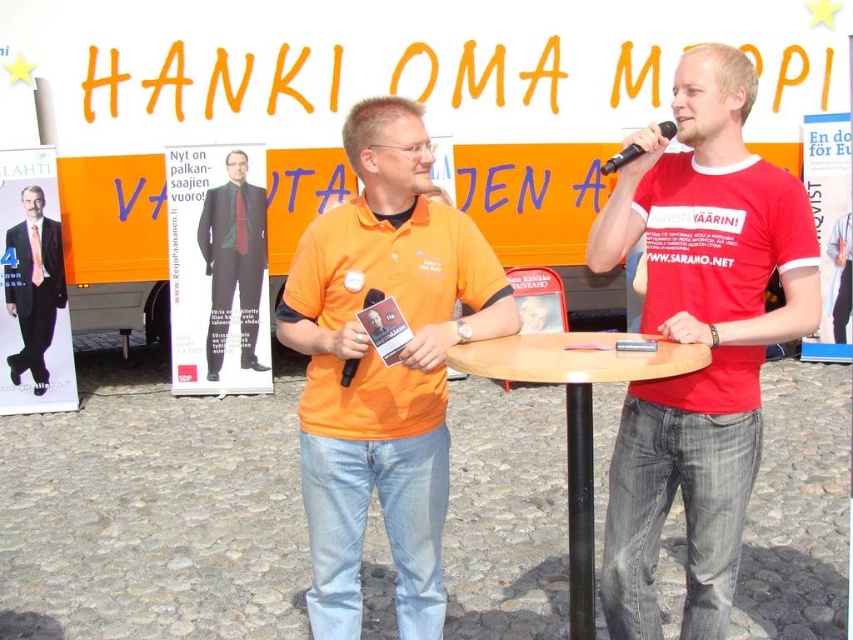
Is red cotton t-shirt at center below dark suit at left?

Yes, red cotton t-shirt at center is below dark suit at left.

Looking at this image, who is shorter, red cotton t-shirt at center or dark suit at left?

Standing shorter between the two is dark suit at left.

Is point (614, 588) farther from camera compared to point (44, 225)?

No, (614, 588) is in front of (44, 225).

Image resolution: width=853 pixels, height=640 pixels. I want to click on red cotton t-shirt at center, so click(x=699, y=339).

How far apart are dark suit at left and black plastic microphone at center?

5.31 meters

Between point (16, 262) and point (383, 298), which one is positioned in front?

Point (383, 298) is in front.

Locate an element on the screen. The height and width of the screenshot is (640, 853). dark suit at left is located at coordinates (33, 285).

Is red cotton t-shirt at center wider than orange cotton polo shirt at center?

In fact, red cotton t-shirt at center might be narrower than orange cotton polo shirt at center.

Is red cotton t-shirt at center shorter than orange cotton polo shirt at center?

Incorrect, red cotton t-shirt at center's height does not fall short of orange cotton polo shirt at center's.

The height and width of the screenshot is (640, 853). Describe the element at coordinates (699, 339) in the screenshot. I see `red cotton t-shirt at center` at that location.

Identify the location of red cotton t-shirt at center. The width and height of the screenshot is (853, 640). (699, 339).